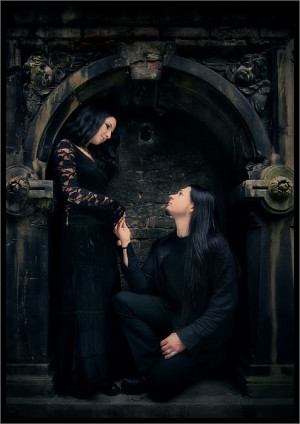
Locate an element on the screen. angel sculpture is located at coordinates tap(250, 75), tap(44, 71).